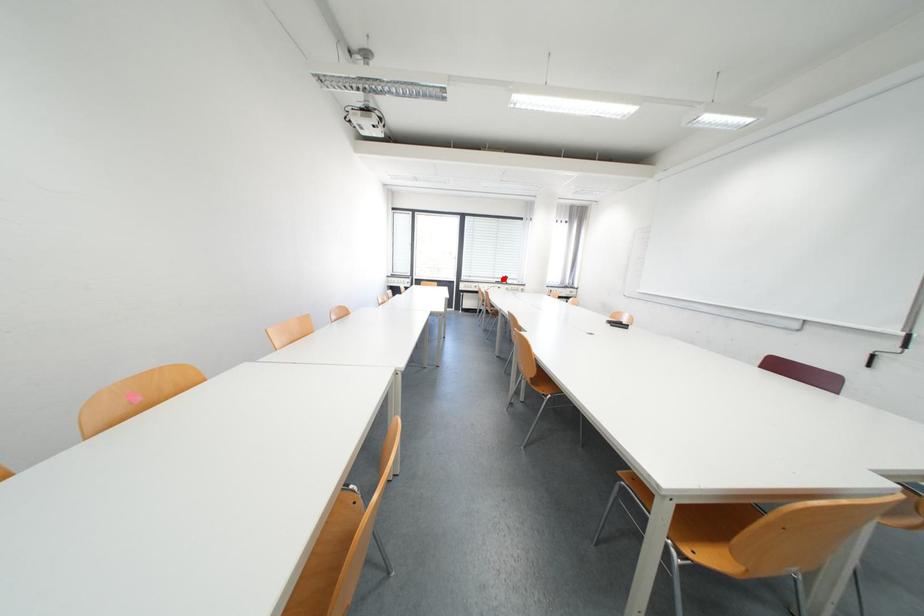
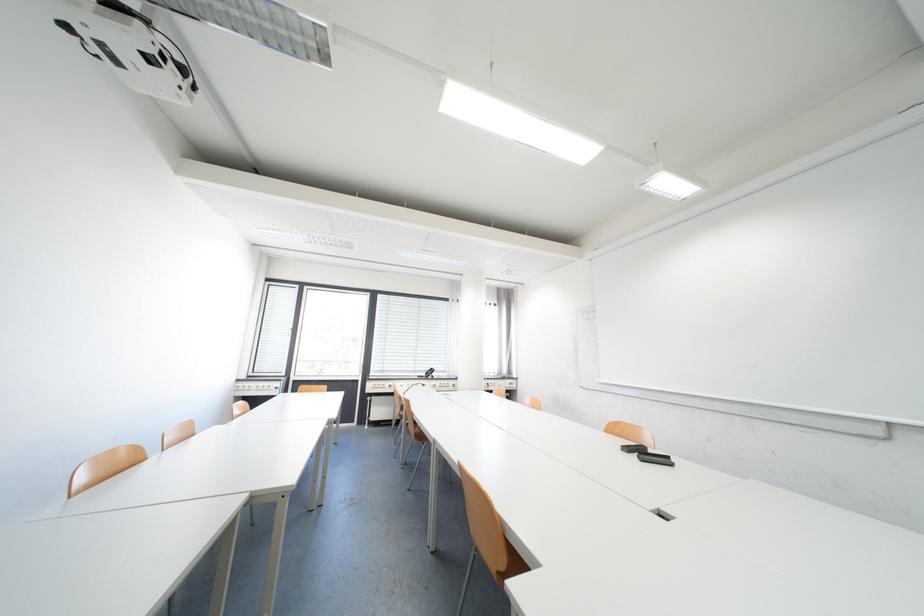
Question: I am providing you with two images of the same scene from different viewpoints. Given a red point in image1, look at the same physical point in image2. Is it:

Choices:
 (A) Closer to the viewpoint
 (B) Farther from the viewpoint

Answer: (B)